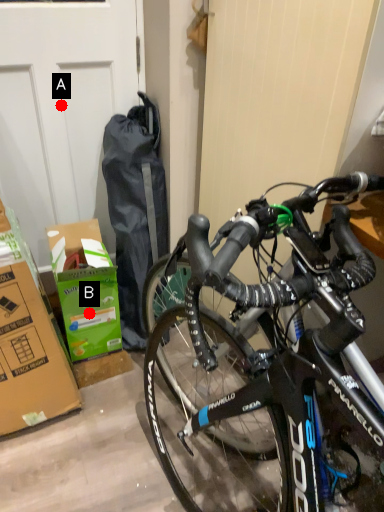
Question: Two points are circled on the image, labeled by A and B beside each circle. Which point is closer to the camera?

Choices:
 (A) A is closer
 (B) B is closer

Answer: (A)